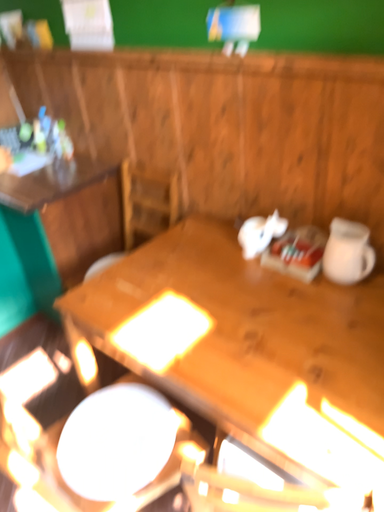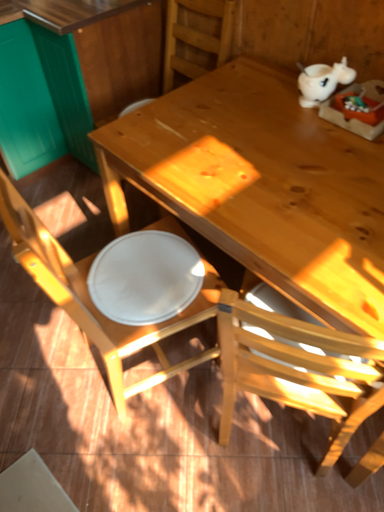
Question: Which way did the camera rotate in the video?

Choices:
 (A) rotated downward
 (B) rotated upward

Answer: (A)